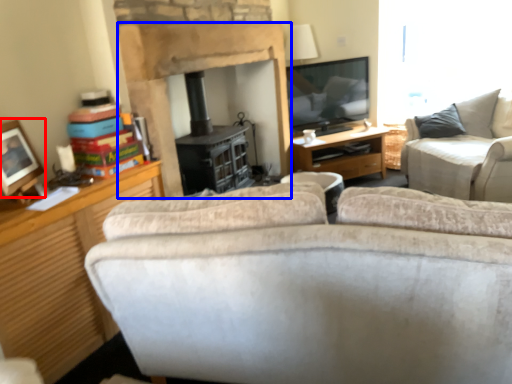
Question: Which point is further to the camera, picture frame (highlighted by a red box) or fireplace (highlighted by a blue box)?

Choices:
 (A) picture frame
 (B) fireplace

Answer: (B)